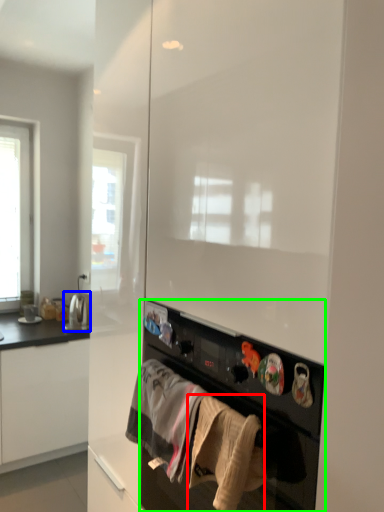
Question: Which object is positioned closest to clothing (highlighted by a red box)? Select from appliance (highlighted by a blue box) and home appliance (highlighted by a green box).

Choices:
 (A) appliance
 (B) home appliance

Answer: (B)